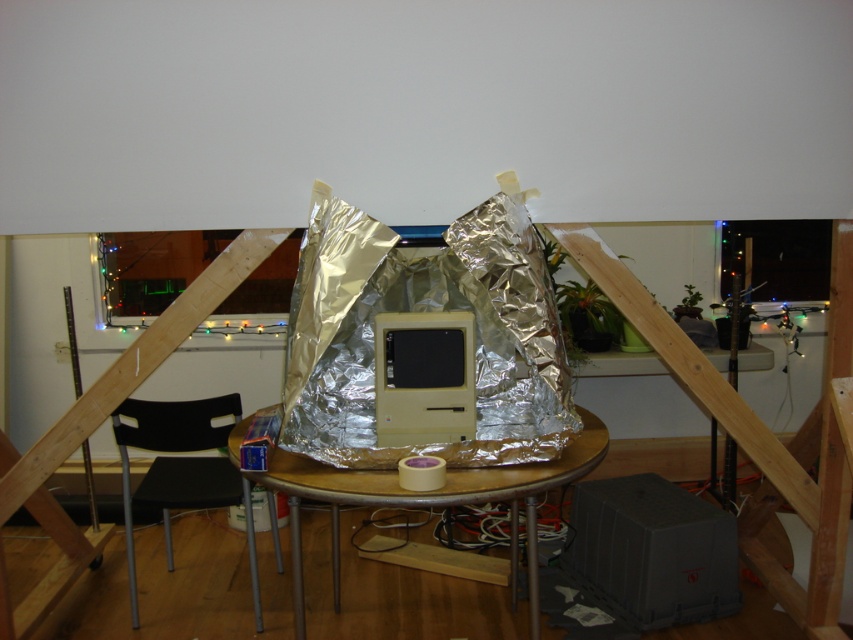
Question: Estimate the real-world distances between objects in this image. Which object is farther from the wooden table at center?

Choices:
 (A) black plastic chair at lower left
 (B) metallic reflective monitor at upper right

Answer: (B)

Question: Estimate the real-world distances between objects in this image. Which object is closer to the matte plastic desktop computer at center?

Choices:
 (A) metallic reflective monitor at upper right
 (B) black plastic chair at lower left
 (C) wooden table at center

Answer: (C)

Question: Which point is closer to the camera?

Choices:
 (A) (265, 474)
 (B) (798, 285)
 (C) (421, 433)
 (D) (125, 472)

Answer: (A)

Question: From the image, what is the correct spatial relationship of black plastic chair at lower left in relation to metallic reflective monitor at upper right?

Choices:
 (A) above
 (B) below

Answer: (B)

Question: Can you confirm if wooden table at center is positioned to the right of matte plastic desktop computer at center?

Choices:
 (A) no
 (B) yes

Answer: (A)

Question: Does wooden table at center come in front of matte plastic desktop computer at center?

Choices:
 (A) no
 (B) yes

Answer: (B)